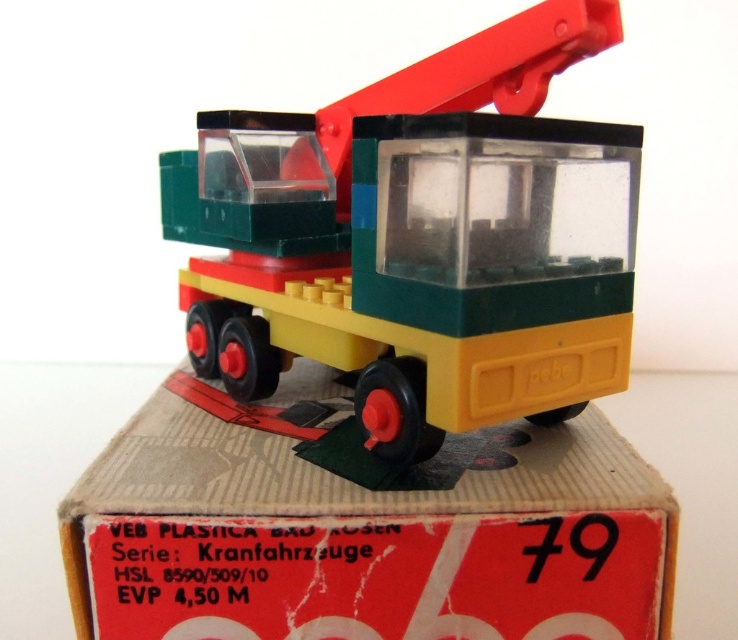
You are a child trying to place the yellow matte truck at center onto the yellow plastic box at center. Can you fit the truck on the box without overlapping?

The yellow matte truck at center is positioned on the left side of yellow plastic box at center, so it is already placed on the box. Therefore, it can fit without overlapping.

You are looking at the vintage toy crane on its box. There are two points marked on the image, one at coordinates point (165, 161) and another at point (573, 593). Which point is closer to you?

Point (165, 161) is further to the camera than point (573, 593). Therefore, point (573, 593) is closer to you.